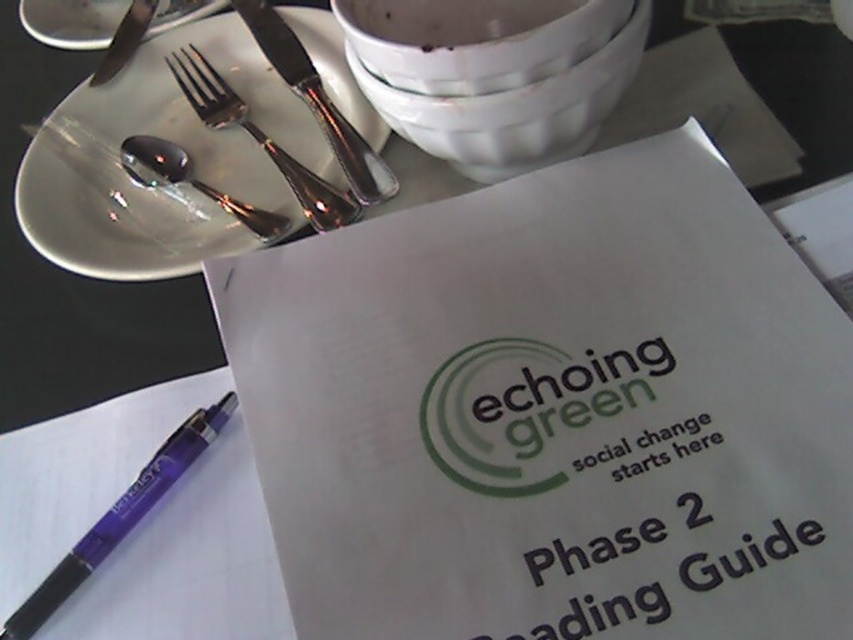
Question: Which object appears farthest from the camera in this image?

Choices:
 (A) purple plastic pen at lower left
 (B) shiny silver spoon at upper left
 (C) white porcelain plate at upper left
 (D) polished silver fork at upper left

Answer: (D)

Question: Which object is closer to the camera taking this photo?

Choices:
 (A) purple plastic pen at lower left
 (B) shiny silver spoon at upper left
 (C) satin silver knife at upper left
 (D) polished metal knife at upper left

Answer: (A)

Question: In this image, where is purple plastic pen at lower left located relative to shiny silver spoon at upper left?

Choices:
 (A) below
 (B) above

Answer: (A)

Question: Which object appears closest to the camera in this image?

Choices:
 (A) polished metal knife at upper left
 (B) silver metallic fork at upper left
 (C) white porcelain plate at upper left

Answer: (C)

Question: Is silver metallic fork at upper left above shiny silver spoon at upper left?

Choices:
 (A) no
 (B) yes

Answer: (B)

Question: Is satin silver knife at upper left bigger than polished metal knife at upper left?

Choices:
 (A) no
 (B) yes

Answer: (B)